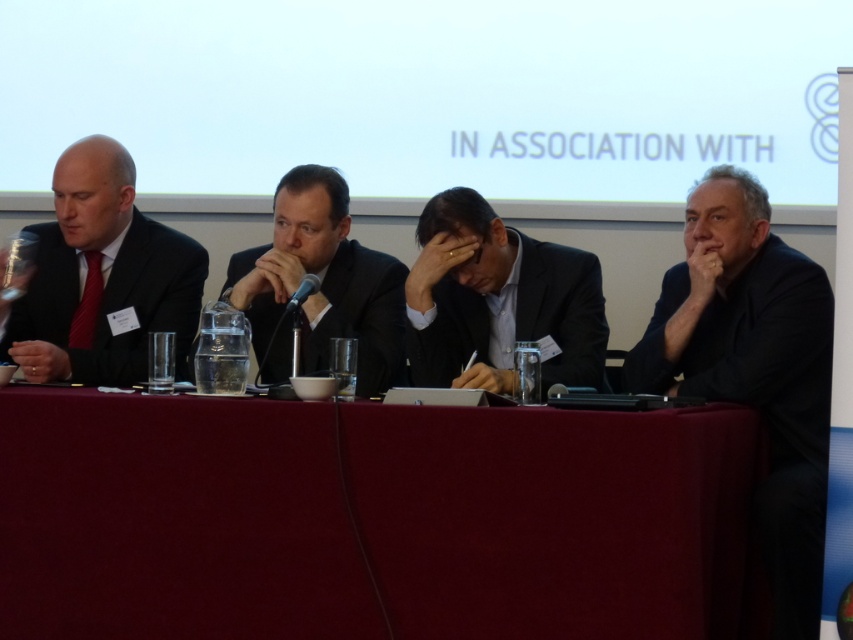
You are organizing a charity event and need to arrange seating based on the size of the suits worn by the attendees. Given that the matte black suit at left and the black suit at center are present, which one should be seated in a larger chair to accommodate their suit size?

The matte black suit at left should be seated in a larger chair because it is bigger than the black suit at center.

In the scene, there is a point at coordinates (102,276). Which object does this point correspond to?

The point at coordinates (102,276) corresponds to the matte black suit at left.